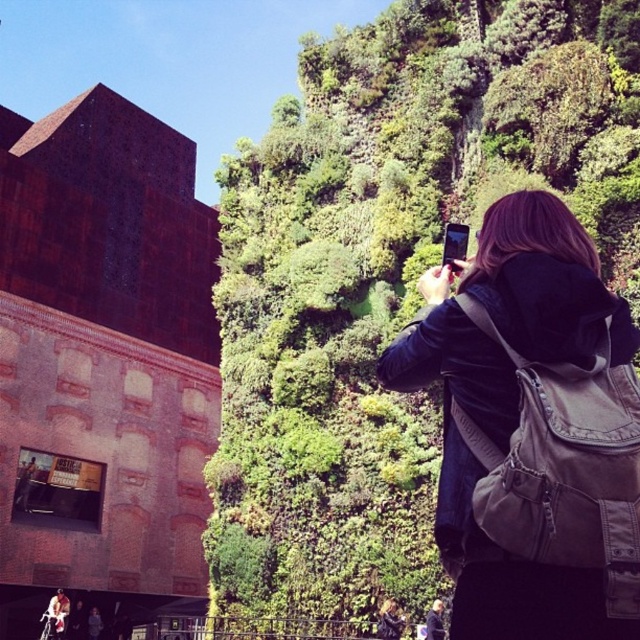
Question: From the image, what is the correct spatial relationship of green leafy wall at upper center in relation to dark brown leather jacket at upper right?

Choices:
 (A) above
 (B) below

Answer: (A)

Question: Which point appears closest to the camera in this image?

Choices:
 (A) (506, 253)
 (B) (236, 547)

Answer: (A)

Question: Can you confirm if green leafy wall at upper center is positioned above dark brown leather jacket at upper right?

Choices:
 (A) no
 (B) yes

Answer: (B)

Question: Among these points, which one is farthest from the camera?

Choices:
 (A) (362, 186)
 (B) (609, 397)

Answer: (A)

Question: Can you confirm if green leafy wall at upper center is thinner than dark brown leather jacket at upper right?

Choices:
 (A) yes
 (B) no

Answer: (B)